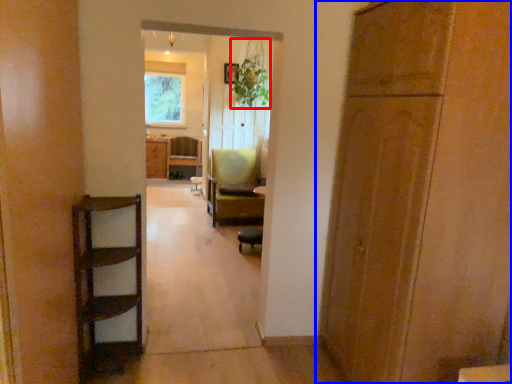
Question: Which object appears farthest to the camera in this image, plant (highlighted by a red box) or door (highlighted by a blue box)?

Choices:
 (A) plant
 (B) door

Answer: (A)